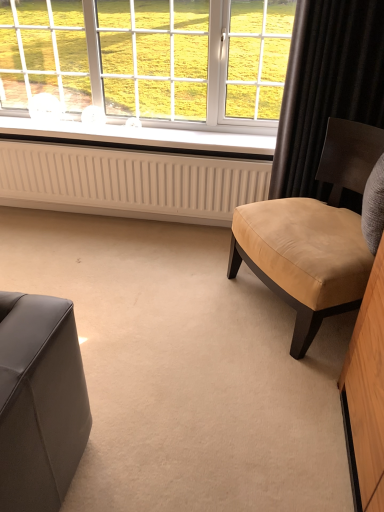
Question: From a real-world perspective, is white ribbed radiator at center located beneath white plastic window sill at center?

Choices:
 (A) yes
 (B) no

Answer: (A)

Question: Does white ribbed radiator at center have a greater height compared to white plastic window sill at center?

Choices:
 (A) no
 (B) yes

Answer: (B)

Question: Considering the relative sizes of white ribbed radiator at center and white plastic window sill at center in the image provided, is white ribbed radiator at center thinner than white plastic window sill at center?

Choices:
 (A) yes
 (B) no

Answer: (A)

Question: Is white ribbed radiator at center next to white plastic window sill at center?

Choices:
 (A) yes
 (B) no

Answer: (B)

Question: Can you confirm if white ribbed radiator at center is smaller than white plastic window sill at center?

Choices:
 (A) yes
 (B) no

Answer: (B)

Question: Considering the relative positions of white ribbed radiator at center and white plastic window sill at center in the image provided, is white ribbed radiator at center to the left of white plastic window sill at center from the viewer's perspective?

Choices:
 (A) yes
 (B) no

Answer: (B)

Question: Can you confirm if black velvet curtain at upper right is wider than white plastic window at upper center?

Choices:
 (A) no
 (B) yes

Answer: (A)

Question: Is black velvet curtain at upper right not within white plastic window at upper center?

Choices:
 (A) no
 (B) yes

Answer: (B)

Question: Considering the relative sizes of black velvet curtain at upper right and white plastic window at upper center in the image provided, is black velvet curtain at upper right taller than white plastic window at upper center?

Choices:
 (A) no
 (B) yes

Answer: (B)

Question: Does black velvet curtain at upper right appear on the right side of white plastic window at upper center?

Choices:
 (A) yes
 (B) no

Answer: (A)

Question: Is black velvet curtain at upper right further to camera compared to white plastic window at upper center?

Choices:
 (A) no
 (B) yes

Answer: (A)

Question: Considering the relative sizes of black velvet curtain at upper right and white plastic window at upper center in the image provided, is black velvet curtain at upper right thinner than white plastic window at upper center?

Choices:
 (A) no
 (B) yes

Answer: (B)

Question: Considering the relative positions of tan leather chair at right and black velvet curtain at upper right in the image provided, is tan leather chair at right to the left of black velvet curtain at upper right from the viewer's perspective?

Choices:
 (A) yes
 (B) no

Answer: (A)